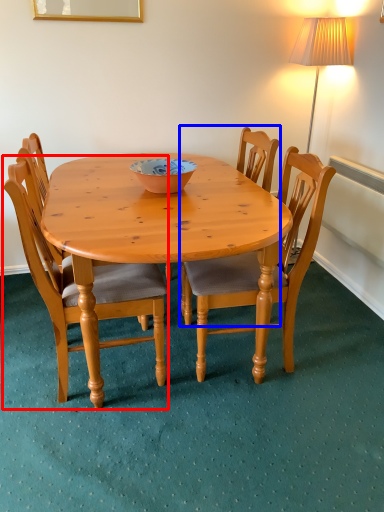
Question: Which object appears farthest to the camera in this image, chair (highlighted by a red box) or chair (highlighted by a blue box)?

Choices:
 (A) chair
 (B) chair

Answer: (B)